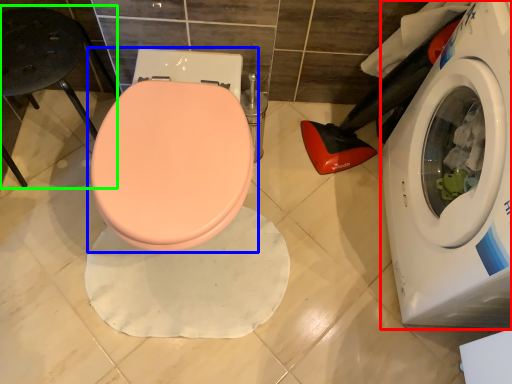
Question: Which object is positioned closest to washing machine (highlighted by a red box)? Select from toilet (highlighted by a blue box) and bar stool (highlighted by a green box).

Choices:
 (A) toilet
 (B) bar stool

Answer: (A)